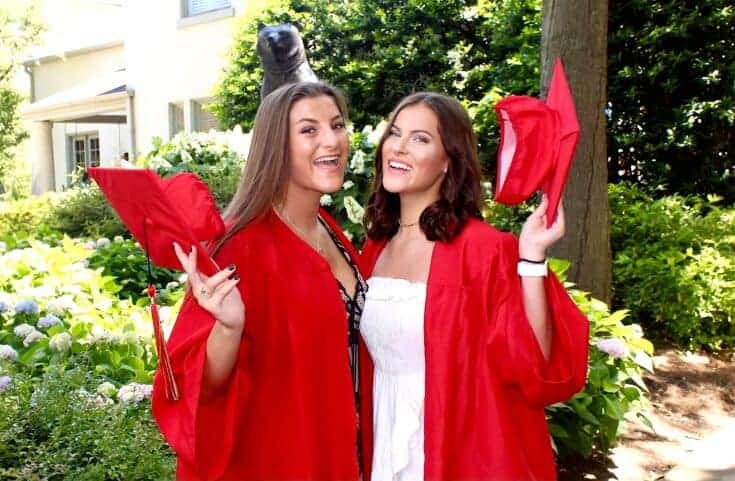
The image size is (735, 481). I want to click on tassel, so click(x=154, y=316).